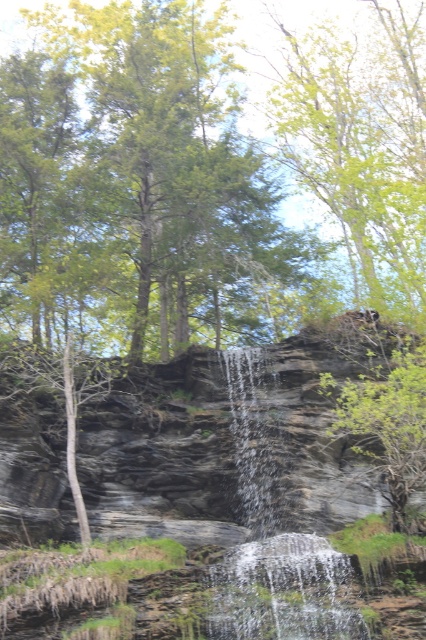
Question: Which point is farther to the camera?

Choices:
 (A) green leafy tree at center
 (B) translucent glass waterfall at center

Answer: (A)

Question: Considering the relative positions of translucent glass waterfall at center and green leafy tree at center in the image provided, where is translucent glass waterfall at center located with respect to green leafy tree at center?

Choices:
 (A) above
 (B) below

Answer: (B)

Question: Among these points, which one is farthest from the camera?

Choices:
 (A) (331, 598)
 (B) (256, 435)
 (C) (408, 529)

Answer: (B)

Question: Observing the image, what is the correct spatial positioning of translucent glass waterfall at center in reference to green leafy tree at center?

Choices:
 (A) above
 (B) below

Answer: (B)

Question: Observing the image, what is the correct spatial positioning of translucent glass waterfall at center in reference to green leafy tree at center?

Choices:
 (A) right
 (B) left

Answer: (B)

Question: Which is nearer to the translucent glass waterfall at center?

Choices:
 (A) green leafy tree at center
 (B) clear glass waterfall at center

Answer: (A)